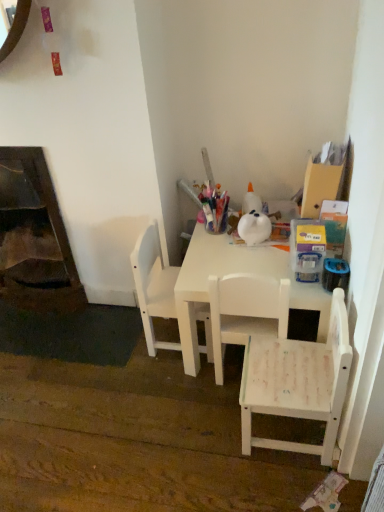
Where is `vacant area that is in front of white matte chair at lower right, the 1th chair viewed from the right`? vacant area that is in front of white matte chair at lower right, the 1th chair viewed from the right is located at coordinates (277, 486).